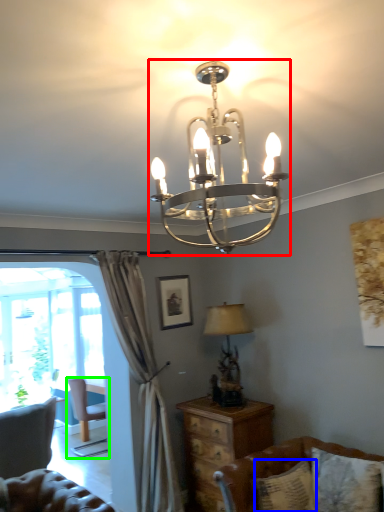
Question: Estimate the real-world distances between objects in this image. Which object is farther from lamp (highlighted by a red box), pillow (highlighted by a blue box) or chair (highlighted by a green box)?

Choices:
 (A) pillow
 (B) chair

Answer: (B)